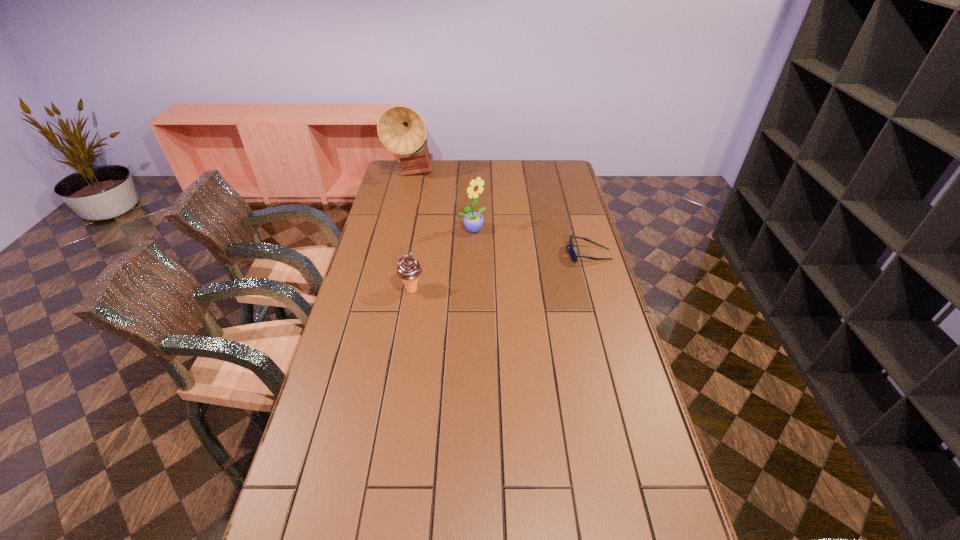
This screenshot has width=960, height=540. Find the location of `the nearest object`. the nearest object is located at coordinates (409, 269).

Find the location of a particular element. The height and width of the screenshot is (540, 960). the second shortest object is located at coordinates 409,269.

Locate an element on the screen. sunglasses is located at coordinates (573, 254).

What are the coordinates of `the third farthest object` in the screenshot? It's located at (573, 254).

Image resolution: width=960 pixels, height=540 pixels. I want to click on the third object from left to right, so click(473, 222).

Where is `sunflower`? sunflower is located at coordinates (473, 222).

Locate an element on the screen. Image resolution: width=960 pixels, height=540 pixels. phonograph record is located at coordinates (401, 129).

Find the location of `the tallest object`. the tallest object is located at coordinates (401, 129).

At what (x,y) coordinates should I click in order to perform the action: click on free location located 0.170m on the right of the icecream. Please return your answer as a coordinate pair (x, y). This screenshot has width=960, height=540. Looking at the image, I should click on click(x=472, y=290).

Find the location of a particular element. The height and width of the screenshot is (540, 960). vacant region located 0.090m on the front-facing side of the second nearest object is located at coordinates (543, 254).